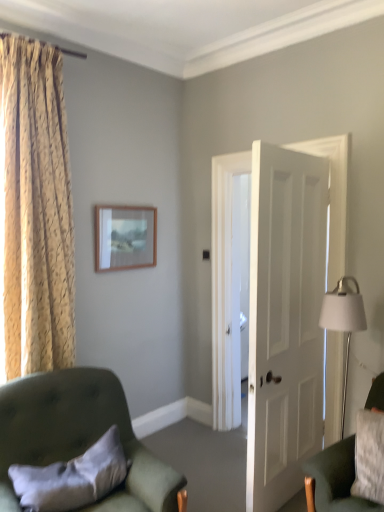
The width and height of the screenshot is (384, 512). Describe the element at coordinates (125, 237) in the screenshot. I see `wooden picture frame at upper center` at that location.

In the scene shown: What is the approximate width of gold textured curtain at left?

11.12 inches.

Locate an element on the screen. The image size is (384, 512). white matte door at center is located at coordinates (221, 265).

What do you see at coordinates (72, 477) in the screenshot?
I see `white soft pillow at lower left` at bounding box center [72, 477].

The width and height of the screenshot is (384, 512). I want to click on wooden picture frame at upper center, so click(x=125, y=237).

The image size is (384, 512). Find the location of `pillow below the gold textured curtain at left (from the image's perspective)`. pillow below the gold textured curtain at left (from the image's perspective) is located at coordinates (72, 477).

Is white soft pillow at lower left positioned in front of gold textured curtain at left?

Yes, the depth of white soft pillow at lower left is less than that of gold textured curtain at left.

Is gold textured curtain at left at the back of white soft pillow at lower left?

No, white soft pillow at lower left is not facing away from gold textured curtain at left.

Which of these two, white soft pillow at lower left or gold textured curtain at left, is thinner?

white soft pillow at lower left.

From the image's perspective, is gold textured curtain at left positioned above or below wooden picture frame at upper center?

gold textured curtain at left is situated higher than wooden picture frame at upper center in the image.

Looking at this image, considering the relative sizes of gold textured curtain at left and wooden picture frame at upper center in the image provided, is gold textured curtain at left bigger than wooden picture frame at upper center?

Indeed, gold textured curtain at left has a larger size compared to wooden picture frame at upper center.

This screenshot has width=384, height=512. In order to click on curtain above the wooden picture frame at upper center (from a real-world perspective) in this screenshot , I will do `click(34, 212)`.

Is wooden picture frame at upper center completely or partially inside gold textured curtain at left?

No, wooden picture frame at upper center is located outside of gold textured curtain at left.

Is wooden picture frame at upper center beside velvet green armchair at lower left, arranged as the 2th chair when viewed from the right?

They are not placed beside each other.

Does wooden picture frame at upper center have a smaller size compared to velvet green armchair at lower left, arranged as the 2th chair when viewed from the right?

Yes.

Which is behind, wooden picture frame at upper center or velvet green armchair at lower left, arranged as the 2th chair when viewed from the right?

wooden picture frame at upper center is further from the camera.

In the scene shown: Could you tell me if wooden picture frame at upper center is facing velvet green armchair at lower left, positioned as the 1th chair in left-to-right order?

No, wooden picture frame at upper center does not turn towards velvet green armchair at lower left, positioned as the 1th chair in left-to-right order.

From the picture: Are white matte door at center and gold textured curtain at left far apart?

Indeed, white matte door at center is not near gold textured curtain at left.

From a real-world perspective, is white matte door at center located higher than gold textured curtain at left?

No.

Looking at this image, do you think white matte door at center is within gold textured curtain at left, or outside of it?

white matte door at center is not enclosed by gold textured curtain at left.

Is white matte door at center positioned with its back to gold textured curtain at left?

No.

Considering the sizes of velvet green armchair at lower right, the second chair when ordered from left to right, and white soft pillow at lower left in the image, is velvet green armchair at lower right, the second chair when ordered from left to right, wider or thinner than white soft pillow at lower left?

Clearly, velvet green armchair at lower right, the second chair when ordered from left to right, has more width compared to white soft pillow at lower left.

Could you measure the distance between velvet green armchair at lower right, arranged as the first chair when viewed from the right, and white soft pillow at lower left?

velvet green armchair at lower right, arranged as the first chair when viewed from the right, and white soft pillow at lower left are 1.04 meters apart from each other.

From a real-world perspective, which object rests below the other?

In real-world perspective, white soft pillow at lower left is lower.

Is velvet green armchair at lower right, arranged as the first chair when viewed from the right, situated inside white soft pillow at lower left or outside?

velvet green armchair at lower right, arranged as the first chair when viewed from the right, lies outside white soft pillow at lower left.

Is velvet green armchair at lower right, the second chair when ordered from left to right, with wooden picture frame at upper center?

No, velvet green armchair at lower right, the second chair when ordered from left to right, is not making contact with wooden picture frame at upper center.

Which is more to the left, velvet green armchair at lower right, the second chair when ordered from left to right, or wooden picture frame at upper center?

wooden picture frame at upper center is more to the left.

Which is behind, point (348, 472) or point (107, 239)?

The point (107, 239) is more distant.

Is velvet green armchair at lower right, the second chair when ordered from left to right, oriented away from wooden picture frame at upper center?

No, wooden picture frame at upper center is not at the back of velvet green armchair at lower right, the second chair when ordered from left to right.

Is velvet green armchair at lower left, arranged as the 2th chair when viewed from the right, positioned with its back to white soft pillow at lower left?

Yes.

Does point (58, 441) lie behind point (58, 473)?

Yes, point (58, 441) is behind point (58, 473).

Is velvet green armchair at lower left, positioned as the 1th chair in left-to-right order, shorter than white soft pillow at lower left?

No.

Is velvet green armchair at lower left, arranged as the 2th chair when viewed from the right, placed right next to white soft pillow at lower left?

No, velvet green armchair at lower left, arranged as the 2th chair when viewed from the right, is not touching white soft pillow at lower left.

Image resolution: width=384 pixels, height=512 pixels. Identify the location of curtain positioned vertically above the white soft pillow at lower left (from a real-world perspective). (34, 212).

Where is `picture frame below the gold textured curtain at left (from the image's perspective)`? The width and height of the screenshot is (384, 512). picture frame below the gold textured curtain at left (from the image's perspective) is located at coordinates (125, 237).

Consider the image. Based on their spatial positions, is velvet green armchair at lower left, arranged as the 2th chair when viewed from the right, or velvet green armchair at lower right, arranged as the first chair when viewed from the right, further from wooden picture frame at upper center?

velvet green armchair at lower right, arranged as the first chair when viewed from the right, is positioned further to the anchor wooden picture frame at upper center.

When comparing their distances from gold textured curtain at left, does velvet green armchair at lower left, positioned as the 1th chair in left-to-right order, or white soft pillow at lower left seem closer?

velvet green armchair at lower left, positioned as the 1th chair in left-to-right order, is closer to gold textured curtain at left.

Looking at the image, which one is located further to velvet green armchair at lower right, the second chair when ordered from left to right, velvet green armchair at lower left, arranged as the 2th chair when viewed from the right, or wooden picture frame at upper center?

The object further to velvet green armchair at lower right, the second chair when ordered from left to right, is wooden picture frame at upper center.

Which object lies nearer to the anchor point gold textured curtain at left, wooden picture frame at upper center or velvet green armchair at lower left, arranged as the 2th chair when viewed from the right?

velvet green armchair at lower left, arranged as the 2th chair when viewed from the right, lies closer to gold textured curtain at left than the other object.

From the image, which object appears to be nearer to white matte door at center, velvet green armchair at lower right, arranged as the first chair when viewed from the right, or white soft pillow at lower left?

Based on the image, velvet green armchair at lower right, arranged as the first chair when viewed from the right, appears to be nearer to white matte door at center.

Estimate the real-world distances between objects in this image. Which object is further from wooden picture frame at upper center, white matte door at center or white soft pillow at lower left?

white soft pillow at lower left lies further to wooden picture frame at upper center than the other object.

When comparing their distances from velvet green armchair at lower left, positioned as the 1th chair in left-to-right order, does wooden picture frame at upper center or velvet green armchair at lower right, arranged as the first chair when viewed from the right, seem further?

wooden picture frame at upper center is further to velvet green armchair at lower left, positioned as the 1th chair in left-to-right order.

From the image, which object appears to be farther from velvet green armchair at lower left, arranged as the 2th chair when viewed from the right, gold textured curtain at left or velvet green armchair at lower right, arranged as the first chair when viewed from the right?

velvet green armchair at lower right, arranged as the first chair when viewed from the right, is positioned further to the anchor velvet green armchair at lower left, arranged as the 2th chair when viewed from the right.

The image size is (384, 512). Identify the location of chair between gold textured curtain at left and velvet green armchair at lower right, the second chair when ordered from left to right. (79, 436).

Find the location of a particular element. chair between white soft pillow at lower left and velvet green armchair at lower right, the second chair when ordered from left to right, from left to right is located at coordinates (79, 436).

At what (x,y) coordinates should I click in order to perform the action: click on pillow between gold textured curtain at left and velvet green armchair at lower right, arranged as the first chair when viewed from the right, in the horizontal direction. Please return your answer as a coordinate pair (x, y). Looking at the image, I should click on (72, 477).

I want to click on pillow between velvet green armchair at lower left, positioned as the 1th chair in left-to-right order, and wooden picture frame at upper center from front to back, so click(72, 477).